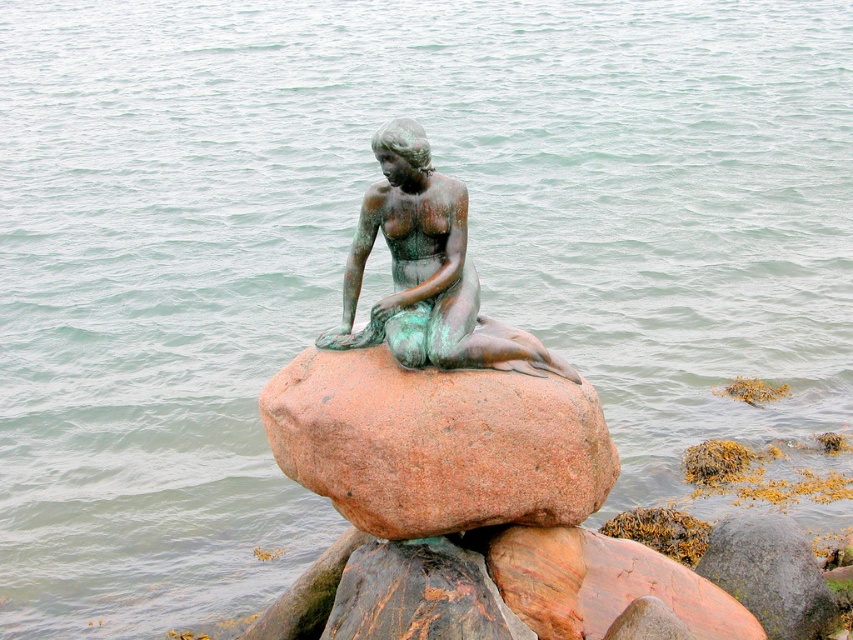
Who is more distant from viewer, (355, 456) or (407, 202)?

Point (407, 202)

Is rusty granite boulder at center to the right of green patina statue at center from the viewer's perspective?

Yes, rusty granite boulder at center is to the right of green patina statue at center.

Looking at this image, who is more forward, (453, 403) or (453, 344)?

Point (453, 403) is in front.

Where is `rusty granite boulder at center`? The width and height of the screenshot is (853, 640). rusty granite boulder at center is located at coordinates (437, 444).

Which of these two, green patina bronze mermaid at center or green patina statue at center, stands shorter?

green patina statue at center is shorter.

Can you confirm if green patina bronze mermaid at center is positioned below green patina statue at center?

No, green patina bronze mermaid at center is not below green patina statue at center.

Which is in front, point (474, 328) or point (444, 193)?

Point (474, 328) is more forward.

This screenshot has height=640, width=853. Identify the location of green patina bronze mermaid at center. (433, 385).

Is green patina bronze mermaid at center shorter than rusty granite boulder at center?

Yes.

Does green patina bronze mermaid at center have a lesser width compared to rusty granite boulder at center?

Yes.

Is point (312, 371) more distant than point (379, 356)?

Yes, point (312, 371) is farther from viewer.

This screenshot has width=853, height=640. I want to click on green patina bronze mermaid at center, so click(x=433, y=385).